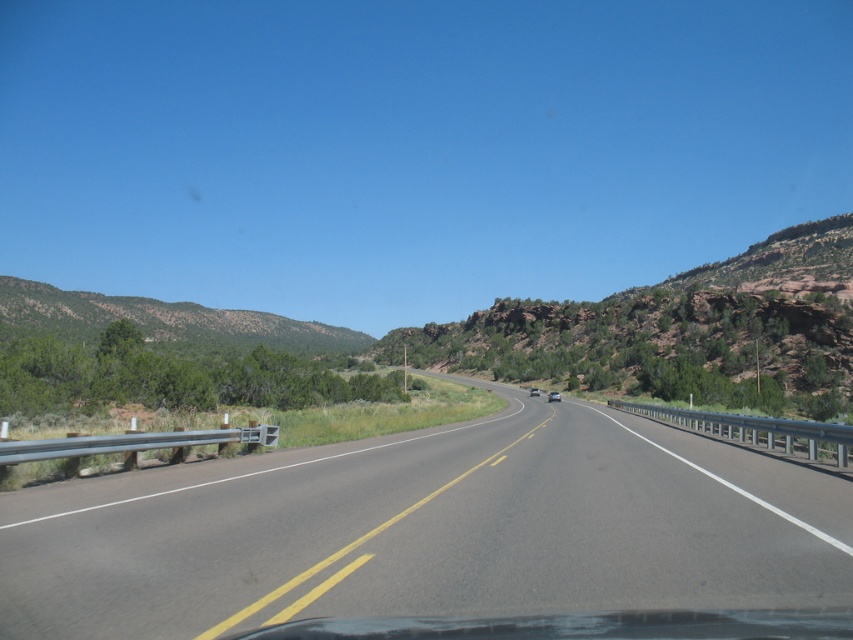
You are a driver approaching the asphalt road at center and white glossy sedan at center. Which object is closer to you?

The asphalt road at center is closer to the viewer than the white glossy sedan at center.

You are driving a metallic silver sedan at center on a mountain road. You notice a green textured hillside at left beside you. Can you estimate whether the hillside is taller than your car?

Result: The green textured hillside at left is taller than the metallic silver sedan at center, so yes, the hillside is taller than the car.

You are standing at the point marked by the coordinates point (163, 321) in the image. Looking around, you see a green textured hillside at left. What direction is the green textured hillside located relative to your position?

The green textured hillside at left is located to the left side of your position as indicated by the coordinates point (163, 321).